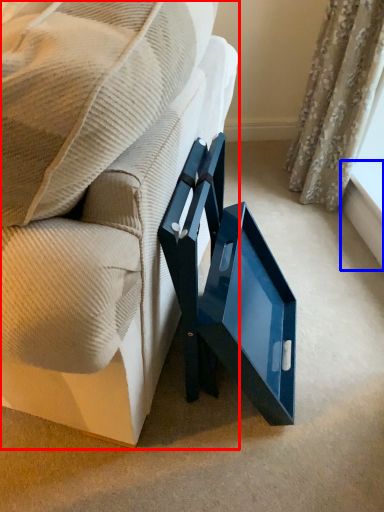
Question: Which of the following is the farthest to the observer, furniture (highlighted by a red box) or window sill (highlighted by a blue box)?

Choices:
 (A) furniture
 (B) window sill

Answer: (B)